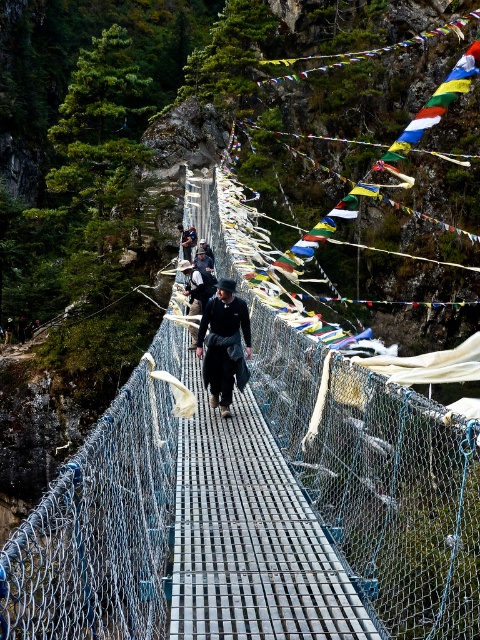
You are standing at the point marked as point (x=187, y=448) on the suspension bridge. You want to take a photo of the entire bridge and the surrounding cliffs. To capture the full view, you need to move to a position that is 30 meters away from your current location. Is your current position sufficient to capture the entire scene, or do you need to move further away?

The point (x=187, y=448) is currently 29.09 meters away from the viewer. Since 29.09 meters is less than the required 30 meters, you need to move further away to achieve the desired distance of 30 meters for capturing the full view.

You are standing on the suspension bridge and want to move from the point at coordinates point (276,502) to the point at coordinates point (216,308). Which direction should you walk to reach your destination?

Since point (276,502) is in front of point 0.483, 052, you should walk backward to reach the destination.